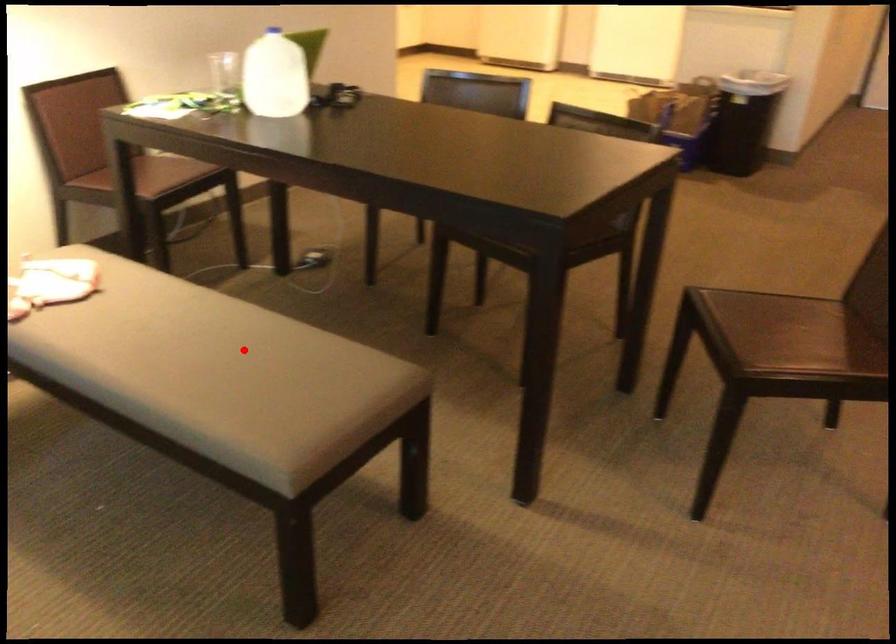
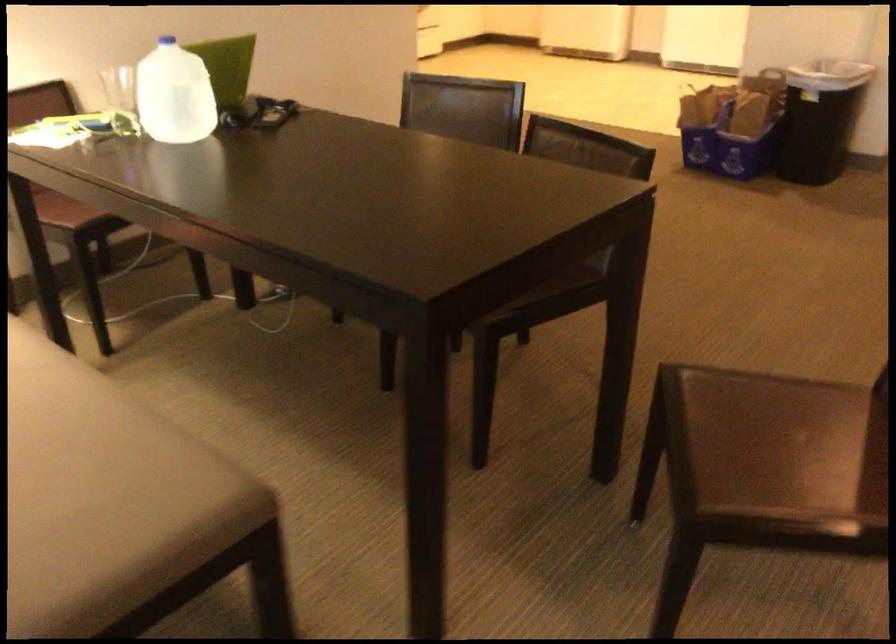
Where in the second image is the point corresponding to the highlighted location from the first image?

(56, 451)